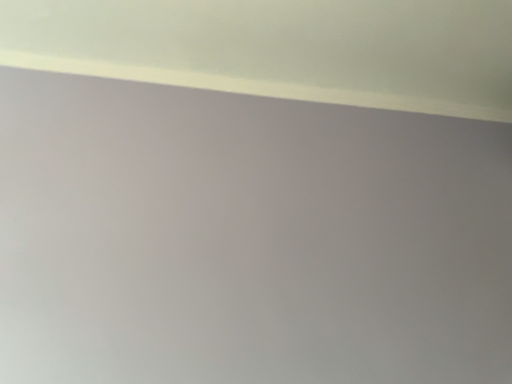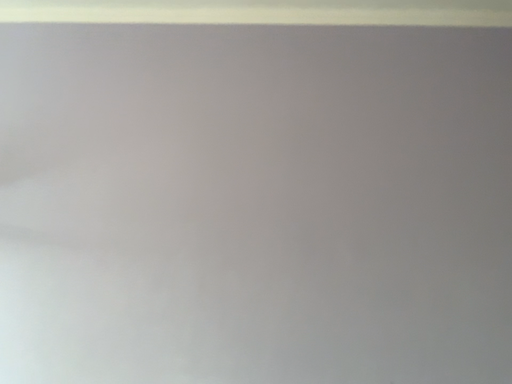
Question: Which way did the camera rotate in the video?

Choices:
 (A) rotated upward
 (B) rotated downward

Answer: (B)